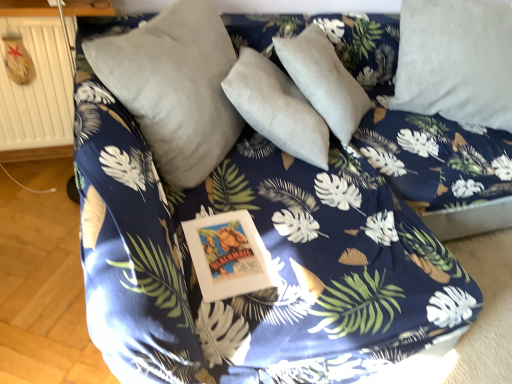
Locate an element on the screen. The width and height of the screenshot is (512, 384). beige wooden radiator at left is located at coordinates (37, 88).

You are a GUI agent. You are given a task and a screenshot of the screen. Output one action in this format:
    pyautogui.click(x=<x>, y=<y>)
    Task: Click on the white soft pillow at upper right, which is the second pillow from left to right
    
    Given the screenshot: What is the action you would take?
    pyautogui.click(x=456, y=61)

What is the approximate width of satin gray pillow at center, the 2th pillow from the right?

It is 13.78 inches.

Locate an element on the screen. This screenshot has height=384, width=512. beige wooden radiator at left is located at coordinates (37, 88).

Does satin gray pillow at center, the 2th pillow from the right, contain white soft pillow at upper right, which is the second pillow from left to right?

No, white soft pillow at upper right, which is the second pillow from left to right, is located outside of satin gray pillow at center, the 2th pillow from the right.

Which is more to the right, satin gray pillow at center, the 2th pillow from the right, or white soft pillow at upper right, positioned as the first pillow in right-to-left order?

white soft pillow at upper right, positioned as the first pillow in right-to-left order, is more to the right.

From a real-world perspective, between satin gray pillow at center, the 2th pillow from the right, and white soft pillow at upper right, which is the second pillow from left to right, who is vertically higher?

satin gray pillow at center, the 2th pillow from the right, from a real-world perspective.

Considering the relative sizes of satin gray pillow at center, the 2th pillow from the right, and white soft pillow at upper right, which is the second pillow from left to right, in the image provided, is satin gray pillow at center, the 2th pillow from the right, thinner than white soft pillow at upper right, which is the second pillow from left to right,?

Indeed, satin gray pillow at center, the 2th pillow from the right, has a lesser width compared to white soft pillow at upper right, which is the second pillow from left to right.

Which object is positioned more to the left, beige wooden radiator at left or white soft pillow at upper right, positioned as the first pillow in right-to-left order?

beige wooden radiator at left is more to the left.

Is beige wooden radiator at left oriented away from white soft pillow at upper right, which is the second pillow from left to right?

No, beige wooden radiator at left is not facing the opposite direction of white soft pillow at upper right, which is the second pillow from left to right.

Is beige wooden radiator at left bigger or smaller than white soft pillow at upper right, positioned as the first pillow in right-to-left order?

Considering their sizes, beige wooden radiator at left takes up less space than white soft pillow at upper right, positioned as the first pillow in right-to-left order.

Can you tell me how much beige wooden radiator at left and white soft pillow at upper right, which is the second pillow from left to right, differ in facing direction?

The angle between the facing direction of beige wooden radiator at left and the facing direction of white soft pillow at upper right, which is the second pillow from left to right, is 30.6 degrees.

Could you measure the distance between beige wooden radiator at left and satin gray pillow at center, the 2th pillow from the right?

beige wooden radiator at left and satin gray pillow at center, the 2th pillow from the right, are 23.81 inches apart.

From a real-world perspective, is beige wooden radiator at left positioned under satin gray pillow at center, the 2th pillow from the right, based on gravity?

Correct, in the physical world, beige wooden radiator at left is lower than satin gray pillow at center, the 2th pillow from the right.

This screenshot has width=512, height=384. Identify the location of radiator above the satin gray pillow at center, the 2th pillow from the right (from the image's perspective). (37, 88).

Would you say beige wooden radiator at left is a long distance from satin gray pillow at center, the 2th pillow from the right?

No, beige wooden radiator at left is not far away from satin gray pillow at center, the 2th pillow from the right.

Considering their positions, is white soft pillow at upper right, positioned as the first pillow in right-to-left order, located in front of or behind beige wooden radiator at left?

white soft pillow at upper right, positioned as the first pillow in right-to-left order, is behind beige wooden radiator at left.

Can you confirm if white soft pillow at upper right, positioned as the first pillow in right-to-left order, is shorter than beige wooden radiator at left?

No, white soft pillow at upper right, positioned as the first pillow in right-to-left order, is not shorter than beige wooden radiator at left.

Considering the sizes of objects white soft pillow at upper right, which is the second pillow from left to right, and beige wooden radiator at left in the image provided, who is smaller, white soft pillow at upper right, which is the second pillow from left to right, or beige wooden radiator at left?

Smaller between the two is beige wooden radiator at left.

Between white soft pillow at upper right, which is the second pillow from left to right, and satin gray pillow at center, the 2th pillow from the right, which one is positioned behind?

white soft pillow at upper right, which is the second pillow from left to right.

Consider the image. Between white soft pillow at upper right, positioned as the first pillow in right-to-left order, and satin gray pillow at center, the 2th pillow from the right, which one has smaller width?

Thinner between the two is satin gray pillow at center, the 2th pillow from the right.

Are white soft pillow at upper right, which is the second pillow from left to right, and satin gray pillow at center, the 2th pillow from the right, beside each other?

There is a gap between white soft pillow at upper right, which is the second pillow from left to right, and satin gray pillow at center, the 2th pillow from the right.

Is white soft pillow at upper right, positioned as the first pillow in right-to-left order, not within satin gray pillow at center, the 2th pillow from the right?

That's correct, white soft pillow at upper right, positioned as the first pillow in right-to-left order, is outside of satin gray pillow at center, the 2th pillow from the right.

Is satin gray pillow at center, the 2th pillow from the right, beside beige wooden radiator at left?

No, satin gray pillow at center, the 2th pillow from the right, is not beside beige wooden radiator at left.

Is satin gray pillow at center, the 2th pillow from the right, aimed at beige wooden radiator at left?

No, satin gray pillow at center, the 2th pillow from the right, is not aimed at beige wooden radiator at left.

From the image's perspective, which object appears higher, satin gray pillow at center, which is the 1th pillow from left to right, or beige wooden radiator at left?

beige wooden radiator at left is shown above in the image.

Considering the points (181, 67) and (19, 92), which point is behind, point (181, 67) or point (19, 92)?

The point (19, 92) is farther from the camera.

Identify the location of pillow lying on the right of satin gray pillow at center, which is the 1th pillow from left to right. (456, 61).

You are a GUI agent. You are given a task and a screenshot of the screen. Output one action in this format:
    pyautogui.click(x=<x>, y=<y>)
    Task: Click on the pillow that is behind the beige wooden radiator at left
    This screenshot has width=512, height=384.
    Given the screenshot: What is the action you would take?
    pyautogui.click(x=456, y=61)

Estimate the real-world distances between objects in this image. Which object is closer to satin gray pillow at center, the 2th pillow from the right, white soft pillow at upper right, positioned as the first pillow in right-to-left order, or beige wooden radiator at left?

Among the two, beige wooden radiator at left is located nearer to satin gray pillow at center, the 2th pillow from the right.

Based on the photo, from the image, which object appears to be nearer to satin gray pillow at center, which is the 1th pillow from left to right, beige wooden radiator at left or white soft pillow at upper right, positioned as the first pillow in right-to-left order?

Among the two, beige wooden radiator at left is located nearer to satin gray pillow at center, which is the 1th pillow from left to right.

Estimate the real-world distances between objects in this image. Which object is closer to white soft pillow at upper right, which is the second pillow from left to right, satin gray pillow at center, which is the 1th pillow from left to right, or beige wooden radiator at left?

The object closer to white soft pillow at upper right, which is the second pillow from left to right, is satin gray pillow at center, which is the 1th pillow from left to right.

Which object lies nearer to the anchor point beige wooden radiator at left, satin gray pillow at center, the 2th pillow from the right, or white soft pillow at upper right, positioned as the first pillow in right-to-left order?

satin gray pillow at center, the 2th pillow from the right, is positioned closer to the anchor beige wooden radiator at left.

Considering their positions, is white soft pillow at upper right, which is the second pillow from left to right, positioned closer to beige wooden radiator at left than satin gray pillow at center, which is the 1th pillow from left to right?

satin gray pillow at center, which is the 1th pillow from left to right.

Based on their spatial positions, is beige wooden radiator at left or satin gray pillow at center, the 2th pillow from the right, closer to white soft pillow at upper right, which is the second pillow from left to right?

The object closer to white soft pillow at upper right, which is the second pillow from left to right, is satin gray pillow at center, the 2th pillow from the right.

Image resolution: width=512 pixels, height=384 pixels. Identify the location of pillow situated between beige wooden radiator at left and white soft pillow at upper right, which is the second pillow from left to right, from left to right. (174, 87).